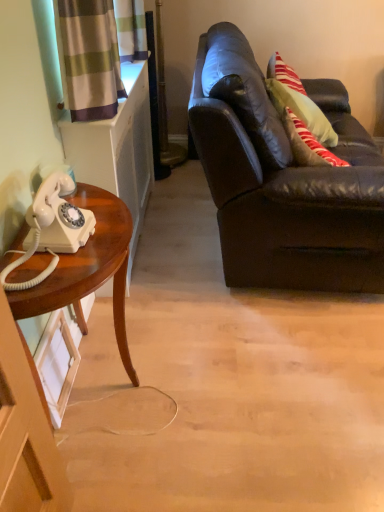
Locate an element on the screen. free area behind wooden desk at left is located at coordinates (165, 307).